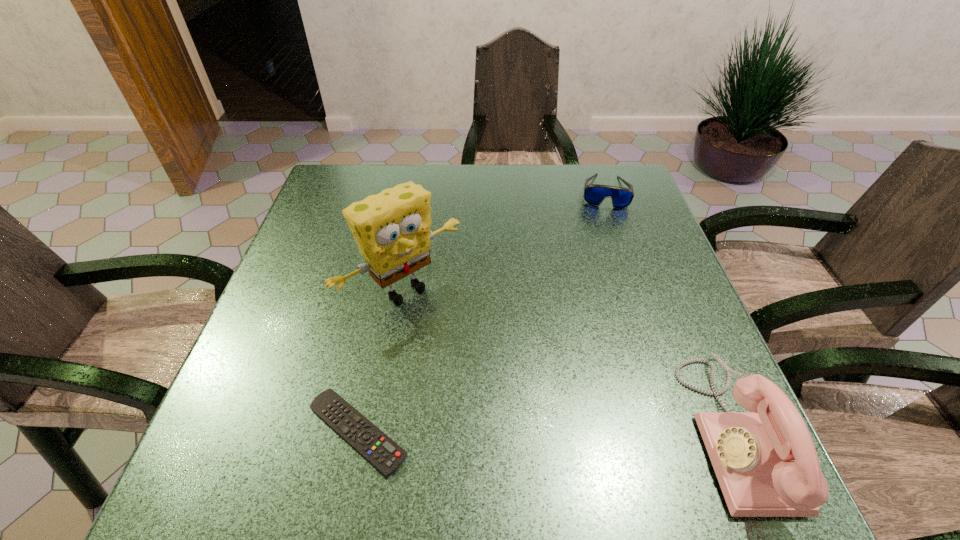
Identify the location of free space between the telephone and the sunglasses. (669, 312).

Choose which object is the nearest neighbor to the farthest object. Please provide its 2D coordinates. Your answer should be formatted as a tuple, i.e. [(x, y)], where the tuple contains the x and y coordinates of a point satisfying the conditions above.

[(392, 229)]

At what (x,y) coordinates should I click in order to perform the action: click on object that is the second closest to the sponge. Please return your answer as a coordinate pair (x, y). The width and height of the screenshot is (960, 540). Looking at the image, I should click on (594, 194).

Locate an element on the screen. This screenshot has height=540, width=960. vacant area that satisfies the following two spatial constraints: 1. on the back side of the second farthest object; 2. on the left side of the second shortest object is located at coordinates (420, 192).

The image size is (960, 540). Find the location of `free location that satisfies the following two spatial constraints: 1. on the front side of the second tallest object; 2. on the dial of the tallest object`. free location that satisfies the following two spatial constraints: 1. on the front side of the second tallest object; 2. on the dial of the tallest object is located at coordinates (380, 431).

Locate an element on the screen. Image resolution: width=960 pixels, height=540 pixels. free space in the image that satisfies the following two spatial constraints: 1. on the front side of the second farthest object; 2. on the dial of the third shortest object is located at coordinates pyautogui.click(x=380, y=431).

The height and width of the screenshot is (540, 960). Identify the location of vacant space that satisfies the following two spatial constraints: 1. on the front side of the third nearest object; 2. on the dial of the second tallest object. (380, 431).

I want to click on free region that satisfies the following two spatial constraints: 1. on the front side of the second shortest object; 2. on the dial of the third shortest object, so click(686, 431).